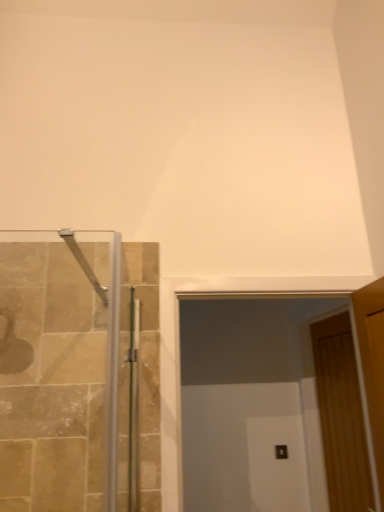
Question: From a real-world perspective, is wooden door at right positioned above or below transparent glass door at center?

Choices:
 (A) below
 (B) above

Answer: (A)

Question: From the image's perspective, relative to transparent glass door at center, is wooden door at right above or below?

Choices:
 (A) above
 (B) below

Answer: (B)

Question: Is wooden door at right wider or thinner than transparent glass door at center?

Choices:
 (A) wide
 (B) thin

Answer: (B)

Question: From a real-world perspective, is transparent glass door at center physically located above or below wooden door at right?

Choices:
 (A) above
 (B) below

Answer: (A)

Question: Based on their sizes in the image, would you say transparent glass door at center is bigger or smaller than wooden door at right?

Choices:
 (A) big
 (B) small

Answer: (A)

Question: From the image's perspective, relative to wooden door at right, is transparent glass door at center above or below?

Choices:
 (A) above
 (B) below

Answer: (A)

Question: Is transparent glass door at center situated inside wooden door at right or outside?

Choices:
 (A) outside
 (B) inside

Answer: (A)